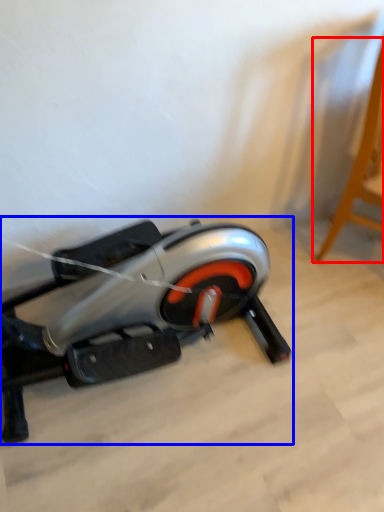
Question: Which point is closer to the camera, furniture (highlighted by a red box) or stationary bicycle (highlighted by a blue box)?

Choices:
 (A) furniture
 (B) stationary bicycle

Answer: (B)